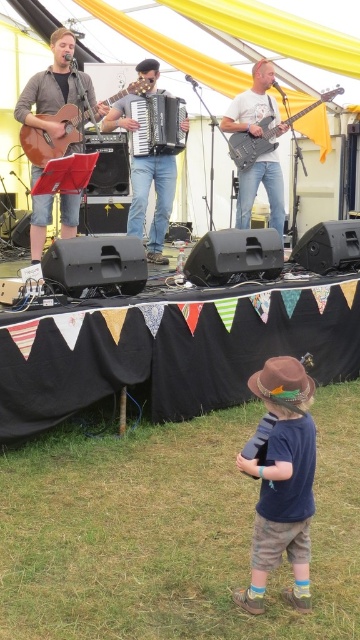
Question: Does black matte accordion at center have a smaller size compared to brown felt cowboy hat at lower center?

Choices:
 (A) no
 (B) yes

Answer: (A)

Question: Among these points, which one is farthest from the camera?

Choices:
 (A) pyautogui.click(x=276, y=486)
 (B) pyautogui.click(x=64, y=81)

Answer: (B)

Question: Which is farther from the brown felt cowboy hat at lower center?

Choices:
 (A) matte black accordion at center
 (B) brown felt hat at lower center
 (C) matte brown acoustic guitar at left

Answer: (A)

Question: Which point is closer to the camera taking this photo?

Choices:
 (A) (x=266, y=385)
 (B) (x=258, y=388)

Answer: (A)

Question: Can you confirm if matte brown guitar at left is positioned above matte white t-shirt at center?

Choices:
 (A) yes
 (B) no

Answer: (A)

Question: Does brown felt hat at lower center lie in front of metallic black bass at upper right?

Choices:
 (A) yes
 (B) no

Answer: (A)